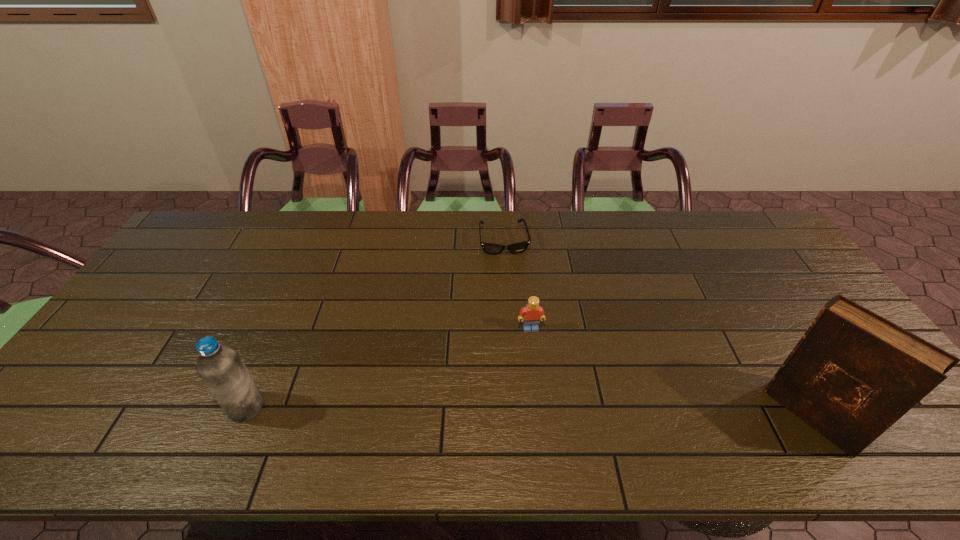
The image size is (960, 540). What are the coordinates of `free space located on the front-facing side of the Lego` in the screenshot? It's located at (544, 399).

I want to click on vacant space positioned on the front-facing side of the Lego, so click(x=538, y=365).

Identify the location of vacant space located 0.250m on the front-facing side of the Lego. This screenshot has height=540, width=960. (547, 414).

Image resolution: width=960 pixels, height=540 pixels. I want to click on vacant space located 0.310m on the front-facing side of the shortest object, so click(x=519, y=328).

The height and width of the screenshot is (540, 960). In order to click on vacant space situated 0.080m on the front-facing side of the shortest object in this screenshot , I will do `click(510, 273)`.

This screenshot has width=960, height=540. I want to click on free space located on the front-facing side of the shortest object, so click(516, 313).

Identify the location of object that is at the far edge. The width and height of the screenshot is (960, 540). (490, 248).

Where is `water bottle that is at the near edge`? This screenshot has width=960, height=540. water bottle that is at the near edge is located at coordinates (220, 367).

Locate an element on the screen. Bible positioned at the near edge is located at coordinates (853, 374).

Identify the location of object located in the right edge section of the desktop. This screenshot has width=960, height=540. (853, 374).